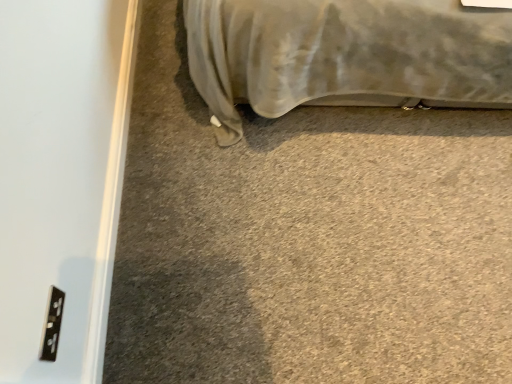
Find the location of a particular element. The height and width of the screenshot is (384, 512). black plastic electric outlet at lower left is located at coordinates (53, 325).

What do you see at coordinates (53, 325) in the screenshot?
I see `black plastic electric outlet at lower left` at bounding box center [53, 325].

Find the location of `black plastic electric outlet at lower left`. black plastic electric outlet at lower left is located at coordinates (53, 325).